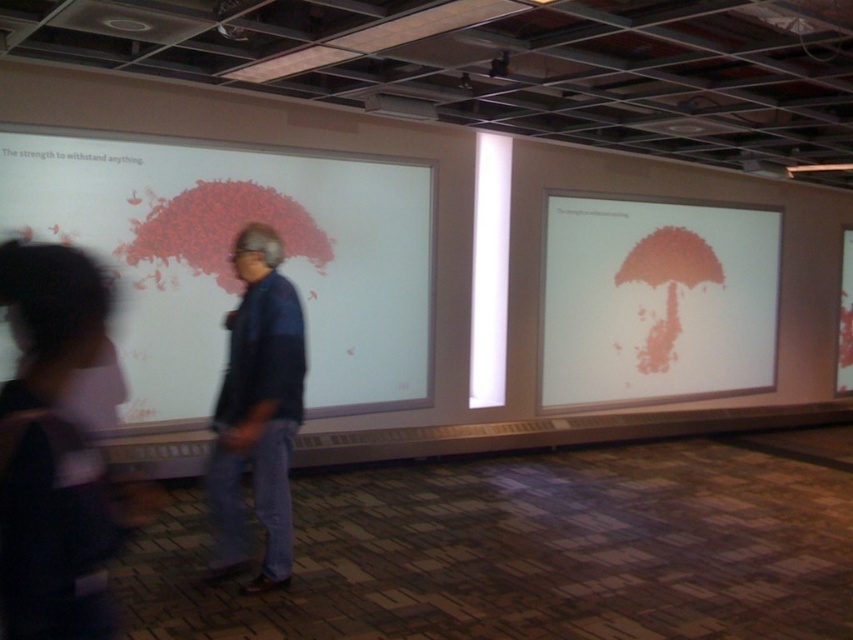
You are standing in the presentation space and want to move from the point at coordinates point (166, 227) to the point at coordinates point (1, 388). Can you walk directly between them without any obstacles?

Point (166, 227) is behind point (1, 388), so you cannot walk directly between them without passing through the point (1, 388) first.

You are an event planner setting up for a presentation. You have a matte white board at upper left and a denim jacket at center. Which object is wider?

The matte white board at upper left is wider than the denim jacket at center according to the description.